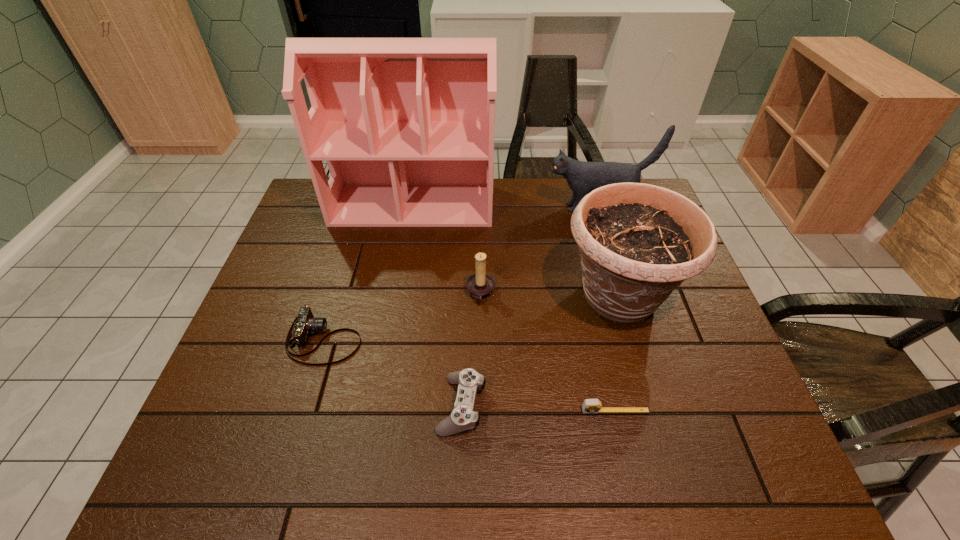
The image size is (960, 540). Find the location of `vacant region located 0.330m at the face of the cat`. vacant region located 0.330m at the face of the cat is located at coordinates (443, 207).

Locate an element on the screen. vacant space located on the back of the flowerpot is located at coordinates (604, 244).

You are a GUI agent. You are given a task and a screenshot of the screen. Output one action in this format:
    pyautogui.click(x=<x>, y=<y>)
    Task: Click on the free space located on the wick of the fourth shortest object
    
    Given the screenshot: What is the action you would take?
    pyautogui.click(x=386, y=293)

Locate an element on the screen. free space located on the wick of the fourth shortest object is located at coordinates (431, 293).

This screenshot has height=540, width=960. What are the coordinates of `free space located 0.130m on the wick of the fourth shortest object` in the screenshot? It's located at (417, 293).

What are the coordinates of `free region located 0.310m on the front-facing side of the camera` in the screenshot? It's located at (491, 340).

Find the location of a particular element. This screenshot has width=960, height=540. vacant space positioned on the right of the control is located at coordinates (551, 405).

Where is `vacant space located at the front of the tape measure with the tape extended`? vacant space located at the front of the tape measure with the tape extended is located at coordinates (623, 447).

Where is `dollhouse present at the far edge`? The image size is (960, 540). dollhouse present at the far edge is located at coordinates (406, 125).

What are the coordinates of `cat present at the far edge` in the screenshot? It's located at (582, 177).